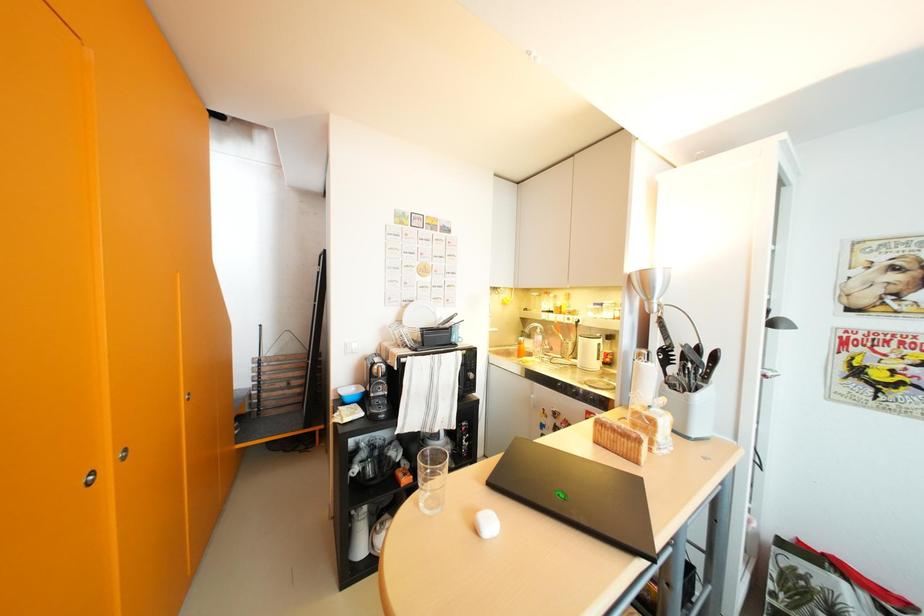
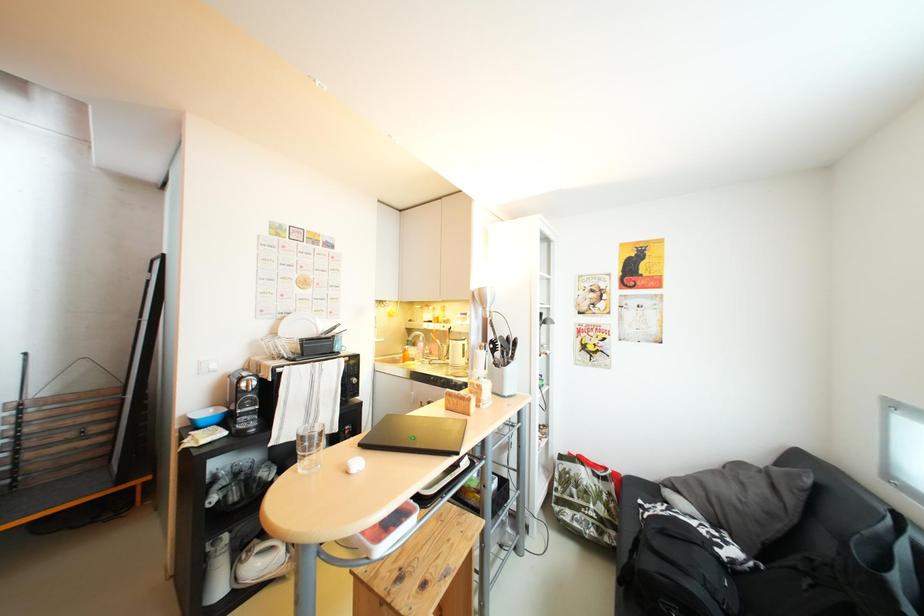
Question: In a continuous first-person perspective shot, in which direction is the camera moving?

Choices:
 (A) Left
 (B) Right
 (C) Forward
 (D) Backward

Answer: (D)